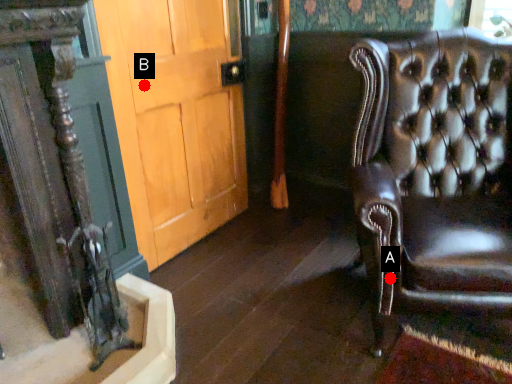
Question: Two points are circled on the image, labeled by A and B beside each circle. Which point is closer to the camera?

Choices:
 (A) A is closer
 (B) B is closer

Answer: (A)